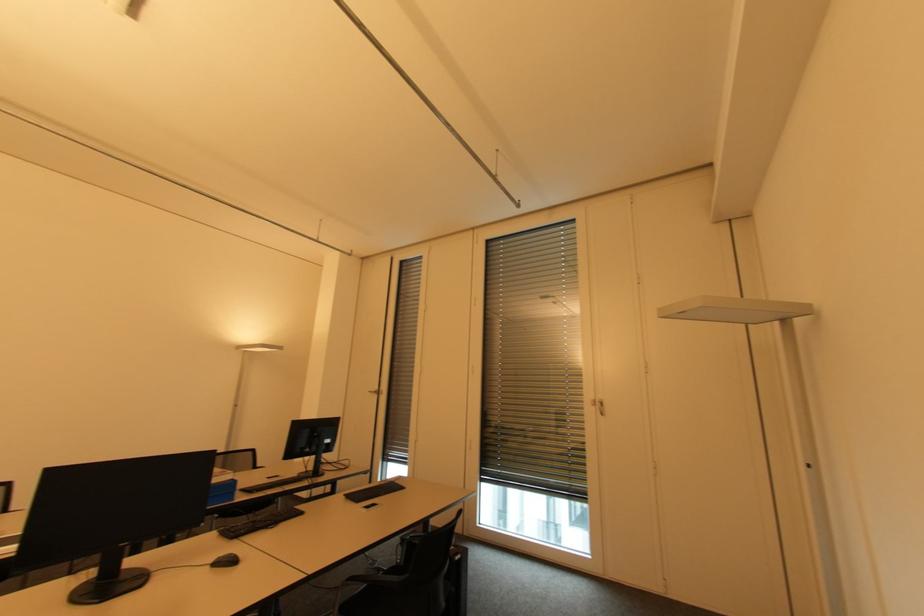
Where is `white cabinet handle`? Image resolution: width=924 pixels, height=616 pixels. white cabinet handle is located at coordinates (600, 406).